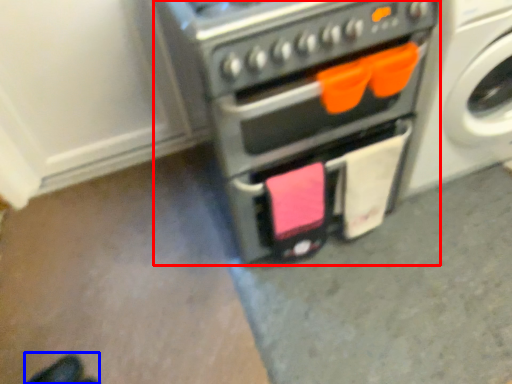
Question: Which of the following is the farthest to the observer, home appliance (highlighted by a red box) or footwear (highlighted by a blue box)?

Choices:
 (A) home appliance
 (B) footwear

Answer: (B)